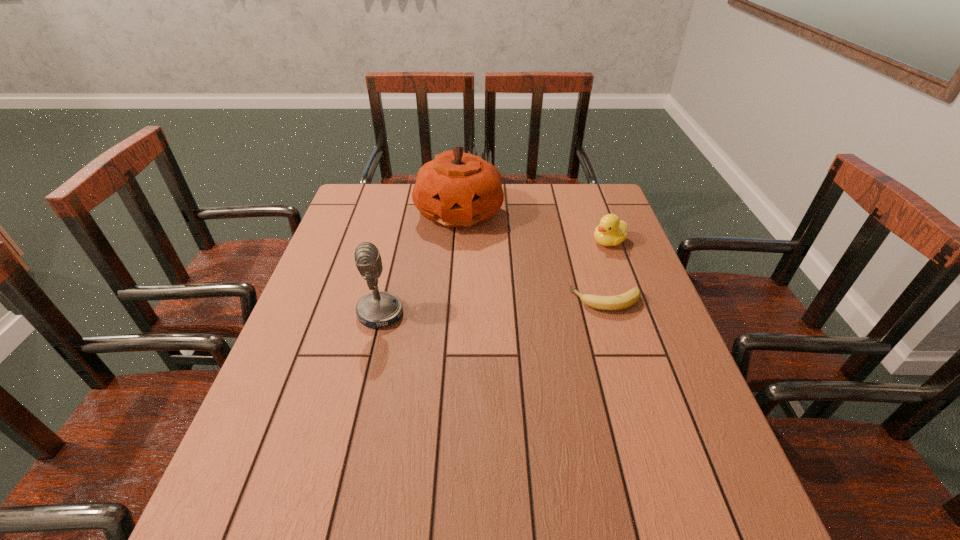
The width and height of the screenshot is (960, 540). I want to click on microphone, so click(379, 308).

Locate an element on the screen. the shortest object is located at coordinates (629, 298).

In order to click on pumpkin in this screenshot , I will do `click(456, 189)`.

Find the location of `duckling`. duckling is located at coordinates (611, 231).

Where is `vacant space located on the front-facing side of the microphone`? The width and height of the screenshot is (960, 540). vacant space located on the front-facing side of the microphone is located at coordinates (325, 314).

This screenshot has height=540, width=960. Identify the location of vacant space located 0.140m on the front-facing side of the microphone. (302, 314).

You are a GUI agent. You are given a task and a screenshot of the screen. Output one action in this format:
    pyautogui.click(x=<x>, y=<y>)
    Task: Click on the vacant space located at the stem of the shortest object
    The height and width of the screenshot is (540, 960).
    Given the screenshot: What is the action you would take?
    pyautogui.click(x=448, y=301)

Locate an element on the screen. The image size is (960, 540). free spot located at the stem of the shortest object is located at coordinates (529, 301).

Image resolution: width=960 pixels, height=540 pixels. I want to click on free space located at the stem of the shortest object, so click(421, 301).

Where is `vacant space located 0.080m on the front-facing side of the pumpkin`? The image size is (960, 540). vacant space located 0.080m on the front-facing side of the pumpkin is located at coordinates (480, 252).